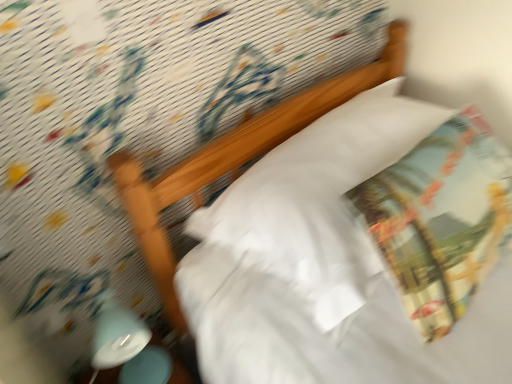
The width and height of the screenshot is (512, 384). What are the coordinates of `empty space that is ontop of white soft pillow at center` in the screenshot? It's located at (341, 183).